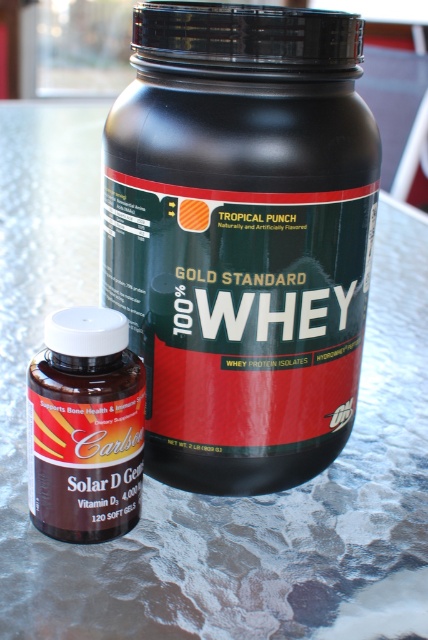
What do you see at coordinates (241, 237) in the screenshot? The image size is (428, 640). I see `black matte protein powder container at center` at bounding box center [241, 237].

Which is behind, point (354, 349) or point (48, 404)?

The point (354, 349) is behind.

Locate an element on the screen. black matte protein powder container at center is located at coordinates (241, 237).

I want to click on black matte protein powder container at center, so click(x=241, y=237).